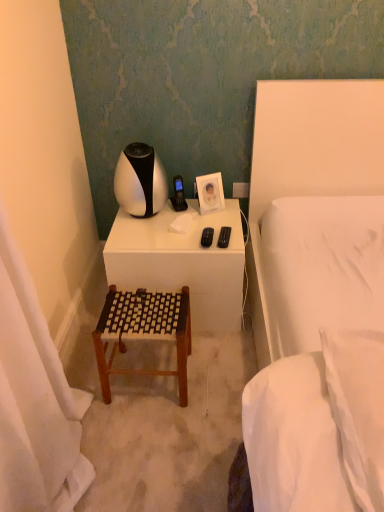
You are a GUI agent. You are given a task and a screenshot of the screen. Output one action in this format:
    pyautogui.click(x=<x>, y=<y>)
    Task: Click on the free space in front of white glossy table lamp at upper center
    The width and height of the screenshot is (384, 512).
    Given the screenshot: What is the action you would take?
    pyautogui.click(x=144, y=237)